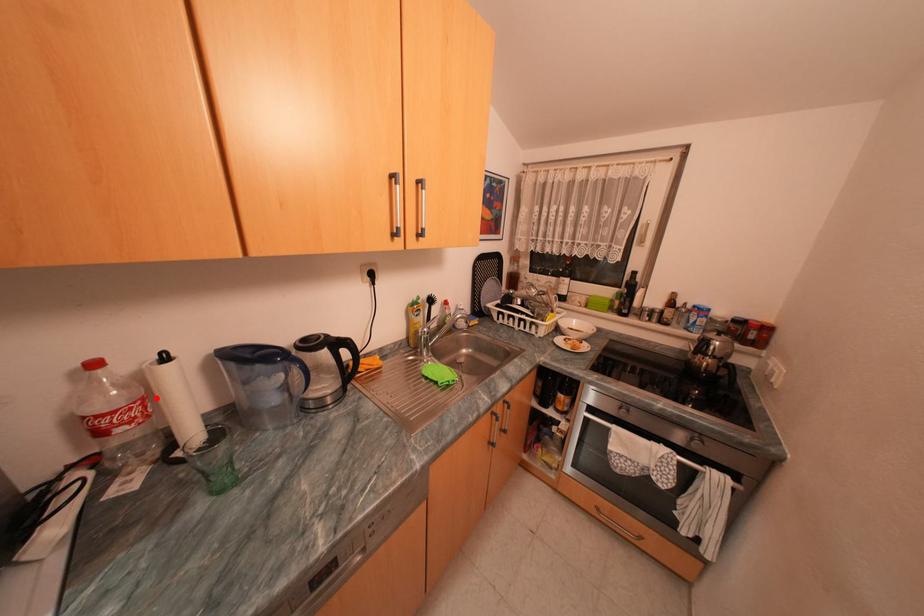
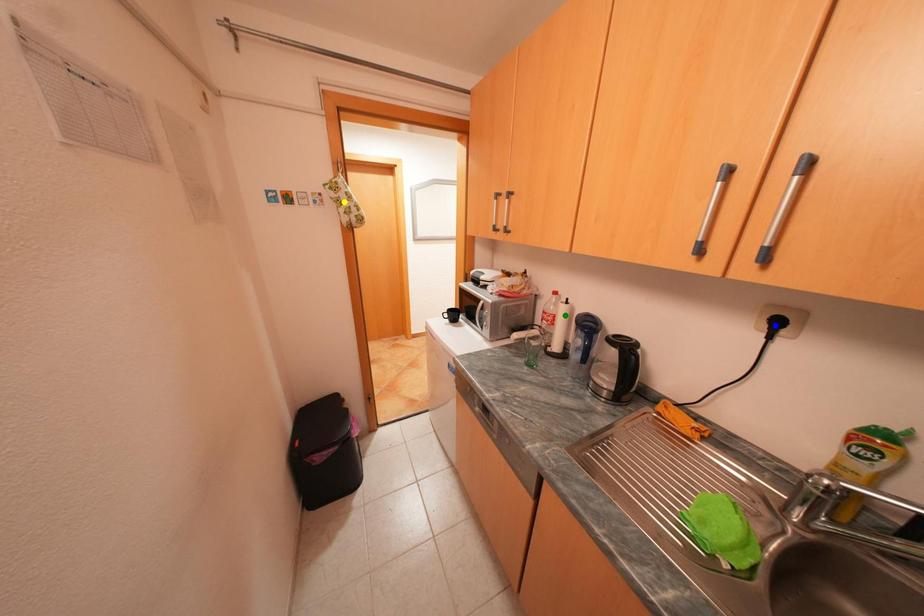
Question: I am providing you with two images of the same scene from different viewpoints. A red point is marked on the first image. You are given multiple points on the second image. Can you choose the point in image 2 that corresponds to the point in image 1?

Choices:
 (A) green point
 (B) blue point
 (C) yellow point

Answer: (A)